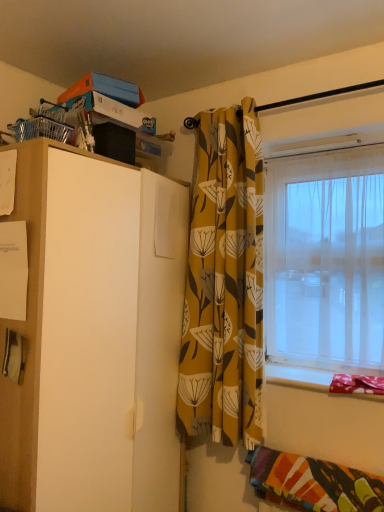
Question: Does multicolored woven blanket at lower right lie behind fabric covered window sill at lower right?

Choices:
 (A) yes
 (B) no

Answer: (B)

Question: From a real-world perspective, is multicolored woven blanket at lower right beneath fabric covered window sill at lower right?

Choices:
 (A) no
 (B) yes

Answer: (B)

Question: Is fabric covered window sill at lower right completely or partially inside multicolored woven blanket at lower right?

Choices:
 (A) no
 (B) yes

Answer: (A)

Question: Does multicolored woven blanket at lower right have a smaller size compared to fabric covered window sill at lower right?

Choices:
 (A) yes
 (B) no

Answer: (B)

Question: Is the depth of multicolored woven blanket at lower right less than that of fabric covered window sill at lower right?

Choices:
 (A) no
 (B) yes

Answer: (B)

Question: From a real-world perspective, is multicolored woven blanket at lower right physically above fabric covered window sill at lower right?

Choices:
 (A) yes
 (B) no

Answer: (B)

Question: Is there a large distance between multicolored woven blanket at lower right and yellow floral fabric curtain at center?

Choices:
 (A) yes
 (B) no

Answer: (B)

Question: From the image's perspective, is multicolored woven blanket at lower right on yellow floral fabric curtain at center?

Choices:
 (A) yes
 (B) no

Answer: (B)

Question: Is multicolored woven blanket at lower right located outside yellow floral fabric curtain at center?

Choices:
 (A) no
 (B) yes

Answer: (B)

Question: Is the position of multicolored woven blanket at lower right less distant than that of yellow floral fabric curtain at center?

Choices:
 (A) yes
 (B) no

Answer: (A)

Question: From a real-world perspective, is multicolored woven blanket at lower right located beneath yellow floral fabric curtain at center?

Choices:
 (A) yes
 (B) no

Answer: (A)

Question: Is multicolored woven blanket at lower right smaller than yellow floral fabric curtain at center?

Choices:
 (A) yes
 (B) no

Answer: (A)

Question: Would you say transparent plastic window at right is a long distance from white matte cabinet at left?

Choices:
 (A) no
 (B) yes

Answer: (A)